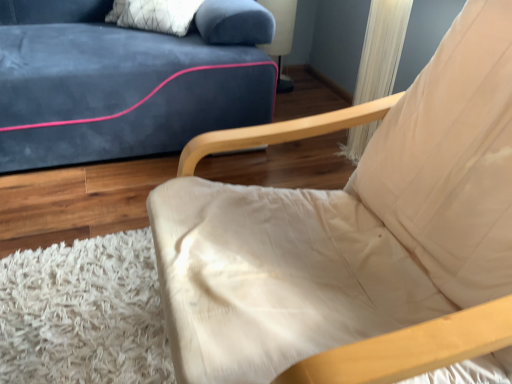
Find the location of a particular element. The width and height of the screenshot is (512, 384). matte plastic table lamp at upper center is located at coordinates (281, 36).

In order to face matte plastic table lamp at upper center, should I rotate leftwards or rightwards?

Turn right approximately 3.051 degrees to face it.

This screenshot has width=512, height=384. Describe the element at coordinates (281, 36) in the screenshot. I see `matte plastic table lamp at upper center` at that location.

Find the location of a particular element. This screenshot has width=512, height=384. beige fabric chair at center is located at coordinates (351, 227).

What do you see at coordinates (351, 227) in the screenshot?
I see `beige fabric chair at center` at bounding box center [351, 227].

In order to click on matte plastic table lamp at upper center in this screenshot , I will do `click(281, 36)`.

Based on their positions, is matte plastic table lamp at upper center located to the left or right of beige fabric chair at center?

matte plastic table lamp at upper center is to the left of beige fabric chair at center.

Relative to beige fabric chair at center, is matte plastic table lamp at upper center in front or behind?

Visually, matte plastic table lamp at upper center is located behind beige fabric chair at center.

Does point (281, 37) come farther from viewer compared to point (437, 218)?

Yes.

From the image's perspective, is matte plastic table lamp at upper center located beneath beige fabric chair at center?

No, from the image's perspective, matte plastic table lamp at upper center is not beneath beige fabric chair at center.

From a real-world perspective, relative to beige fabric chair at center, is matte plastic table lamp at upper center vertically above or below?

Clearly, from a real-world perspective, matte plastic table lamp at upper center is below beige fabric chair at center.

Considering the sizes of matte plastic table lamp at upper center and beige fabric chair at center in the image, is matte plastic table lamp at upper center wider or thinner than beige fabric chair at center?

Clearly, matte plastic table lamp at upper center has less width compared to beige fabric chair at center.

Does matte plastic table lamp at upper center have a lesser height compared to beige fabric chair at center?

Yes, matte plastic table lamp at upper center is shorter than beige fabric chair at center.

Which of these two, matte plastic table lamp at upper center or beige fabric chair at center, is smaller?

With smaller size is matte plastic table lamp at upper center.

Would you say matte plastic table lamp at upper center is inside or outside beige fabric chair at center?

matte plastic table lamp at upper center exists outside the volume of beige fabric chair at center.

Is matte plastic table lamp at upper center next to beige fabric chair at center and touching it?

No, matte plastic table lamp at upper center is not touching beige fabric chair at center.

Is matte plastic table lamp at upper center aimed at beige fabric chair at center?

No, matte plastic table lamp at upper center is not oriented towards beige fabric chair at center.

This screenshot has height=384, width=512. I want to click on table lamp located above the beige fabric chair at center (from the image's perspective), so click(281, 36).

Which is more to the right, beige fabric chair at center or matte plastic table lamp at upper center?

Positioned to the right is beige fabric chair at center.

Is beige fabric chair at center behind matte plastic table lamp at upper center?

No, it is in front of matte plastic table lamp at upper center.

Considering the positions of points (264, 276) and (282, 11), is point (264, 276) closer to camera compared to point (282, 11)?

Yes, point (264, 276) is closer to viewer.

From the image's perspective, does beige fabric chair at center appear higher than matte plastic table lamp at upper center?

No, from the image's perspective, beige fabric chair at center is not on top of matte plastic table lamp at upper center.

From a real-world perspective, is beige fabric chair at center below matte plastic table lamp at upper center?

Incorrect, from a real-world perspective, beige fabric chair at center is higher than matte plastic table lamp at upper center.

Which of these two, beige fabric chair at center or matte plastic table lamp at upper center, is wider?

beige fabric chair at center.

Considering the sizes of objects beige fabric chair at center and matte plastic table lamp at upper center in the image provided, who is shorter, beige fabric chair at center or matte plastic table lamp at upper center?

With less height is matte plastic table lamp at upper center.

Looking at this image, is beige fabric chair at center bigger or smaller than matte plastic table lamp at upper center?

beige fabric chair at center is bigger than matte plastic table lamp at upper center.

Can matte plastic table lamp at upper center be found inside beige fabric chair at center?

No, matte plastic table lamp at upper center is not a part of beige fabric chair at center.

Based on the photo, is the surface of beige fabric chair at center in direct contact with matte plastic table lamp at upper center?

No, beige fabric chair at center is not with matte plastic table lamp at upper center.

Is beige fabric chair at center aimed at matte plastic table lamp at upper center?

No, beige fabric chair at center is not oriented towards matte plastic table lamp at upper center.

Can you tell me how much beige fabric chair at center and matte plastic table lamp at upper center differ in facing direction?

The angle between the facing direction of beige fabric chair at center and the facing direction of matte plastic table lamp at upper center is 5 degrees.

In the image, there is a beige fabric chair at center. Where is `table lamp below it (from a real-world perspective)`? This screenshot has height=384, width=512. table lamp below it (from a real-world perspective) is located at coordinates (281, 36).

The width and height of the screenshot is (512, 384). What are the coordinates of `table lamp below the beige fabric chair at center (from a real-world perspective)` in the screenshot? It's located at (281, 36).

Where is `chair located below the matte plastic table lamp at upper center (from the image's perspective)`? The width and height of the screenshot is (512, 384). chair located below the matte plastic table lamp at upper center (from the image's perspective) is located at coordinates (351, 227).